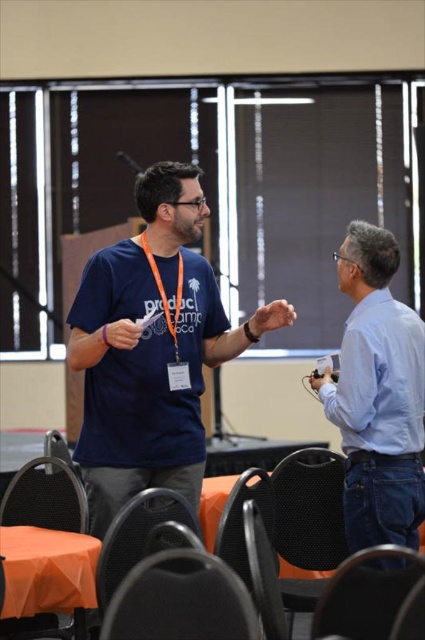
You are standing in the conference room and want to walk towards the point that is closer to you. Which point should you walk towards, point (371, 484) or point (23, 536)?

Point (23, 536) is closer to you, so you should walk towards point (23, 536).